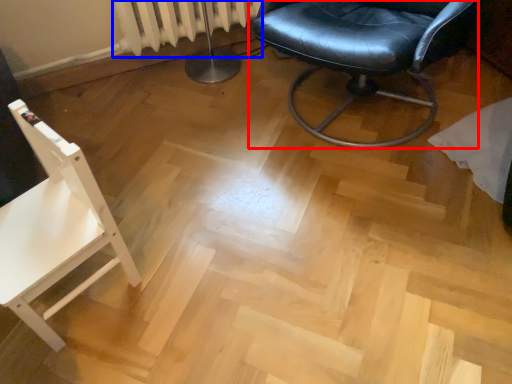
Question: Among these objects, which one is nearest to the camera, chair (highlighted by a red box) or radiator (highlighted by a blue box)?

Choices:
 (A) chair
 (B) radiator

Answer: (A)